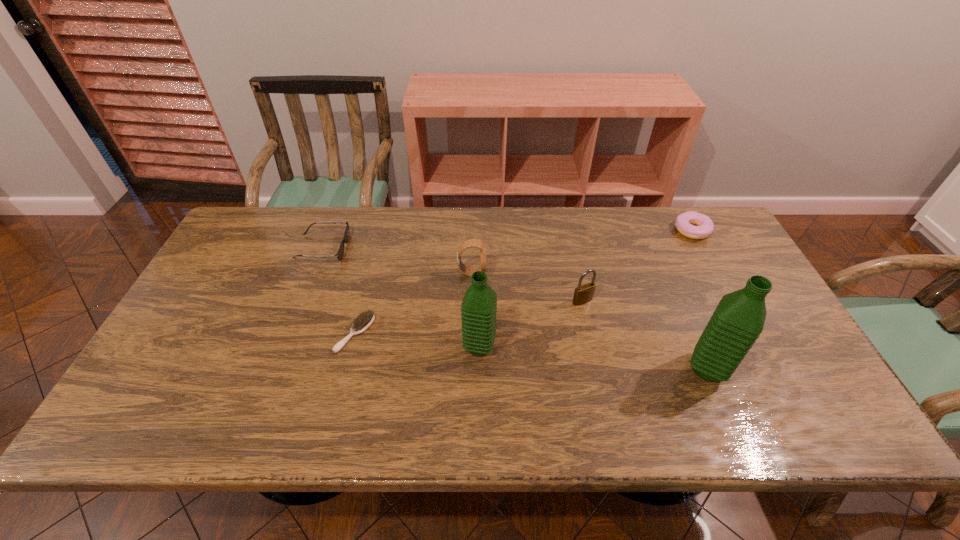
Locate an element on the screen. This screenshot has height=540, width=960. the sixth shortest object is located at coordinates (478, 309).

The image size is (960, 540). I want to click on the left water bottle, so click(x=478, y=309).

Where is `the taller water bottle`? This screenshot has height=540, width=960. the taller water bottle is located at coordinates (739, 318).

Find the location of `the tallest object`. the tallest object is located at coordinates (739, 318).

The height and width of the screenshot is (540, 960). In order to click on sunglasses in this screenshot , I will do `click(339, 255)`.

Image resolution: width=960 pixels, height=540 pixels. What are the coordinates of `the rightmost object` in the screenshot? It's located at (705, 227).

This screenshot has width=960, height=540. Identify the location of watch. (471, 243).

Locate an element on the screen. the third object from right to left is located at coordinates (583, 294).

At what (x,y) coordinates should I click in order to perform the action: click on padlock. Please return your answer as a coordinate pair (x, y). The image size is (960, 540). Looking at the image, I should click on (583, 294).

Find the location of `the second object from left to right`. the second object from left to right is located at coordinates (361, 323).